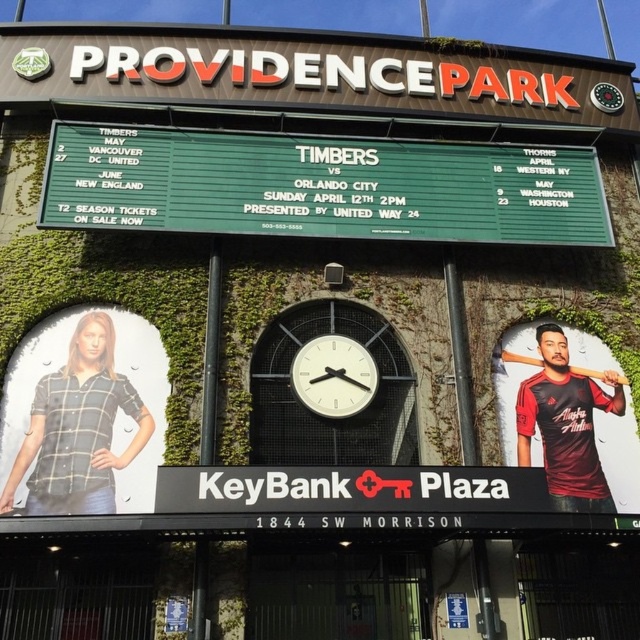
Between green wooden scoreboard at center and black matte baseball bat at center, which one appears on the left side from the viewer's perspective?

green wooden scoreboard at center is more to the left.

Can you confirm if green wooden scoreboard at center is positioned below black matte baseball bat at center?

No, green wooden scoreboard at center is not below black matte baseball bat at center.

Based on the photo, who is more distant from viewer, (298, 221) or (596, 376)?

The point (596, 376) is behind.

Identify the location of green wooden scoreboard at center. The height and width of the screenshot is (640, 640). pos(321,186).

Between point (582, 394) and point (369, 380), which one is positioned in front?

Point (369, 380) is more forward.

Who is higher up, maroon jersey at right or white plastic clock at center?

white plastic clock at center

Consider the image. Who is more distant from viewer, (563, 385) or (374, 371)?

Point (563, 385)

Where is `maroon jersey at right`? The image size is (640, 640). maroon jersey at right is located at coordinates (564, 424).

Can you confirm if green wooden scoreboard at center is positioned to the left of maroon jersey at right?

Yes, green wooden scoreboard at center is to the left of maroon jersey at right.

Is the position of green wooden scoreboard at center less distant than that of maroon jersey at right?

No, green wooden scoreboard at center is further to the viewer.

Does point (376, 154) come in front of point (552, 445)?

No, (376, 154) is further to viewer.

Find the location of a particular element. The image size is (640, 640). green wooden scoreboard at center is located at coordinates pyautogui.click(x=321, y=186).